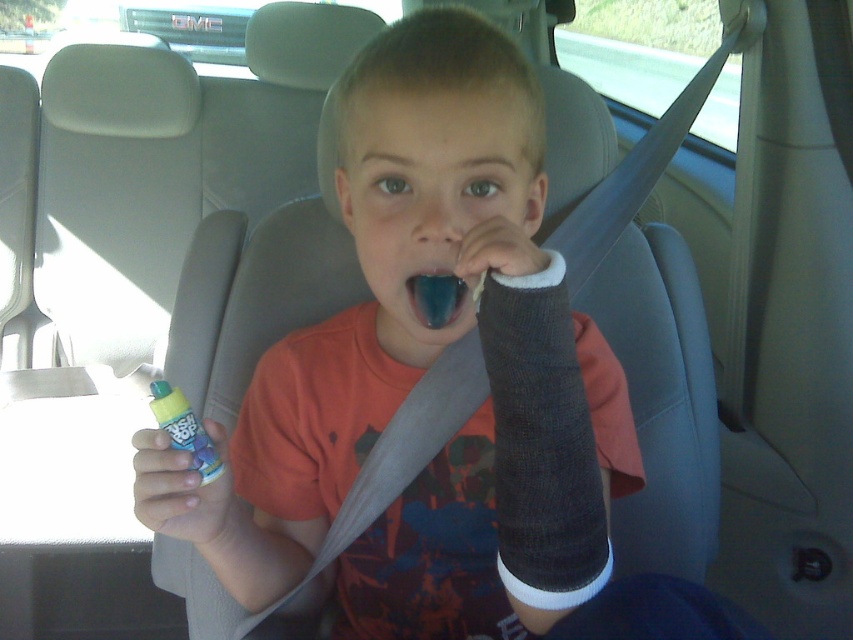
Can you confirm if translucent plastic bottle at lower left is positioned to the left of teeth enamel at center?

Yes, translucent plastic bottle at lower left is to the left of teeth enamel at center.

The image size is (853, 640). Identify the location of translucent plastic bottle at lower left. (184, 429).